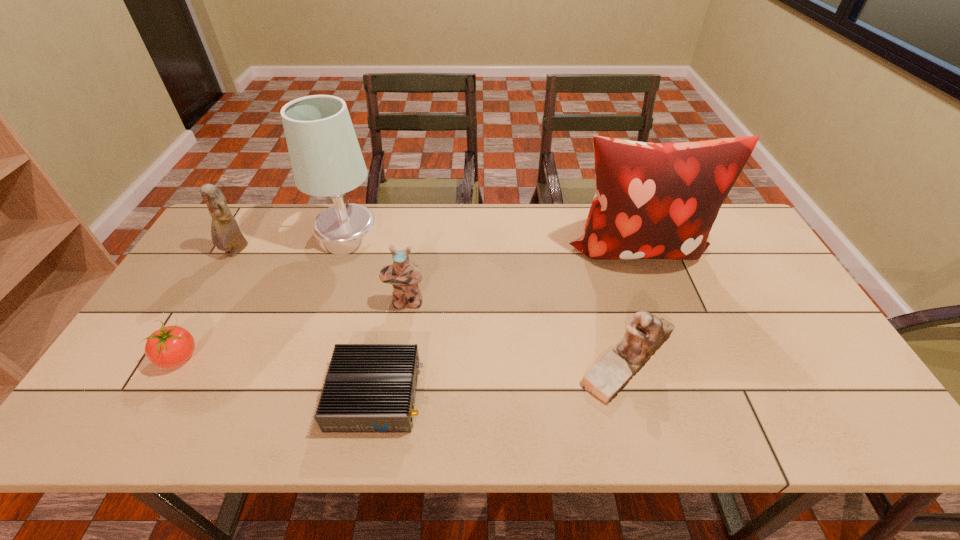
You are a GUI agent. You are given a task and a screenshot of the screen. Output one action in this format:
    pyautogui.click(x=<x>, y=<y>)
    Task: Click on the cushion present at the far edge
    
    Given the screenshot: What is the action you would take?
    pyautogui.click(x=653, y=201)

This screenshot has height=540, width=960. I want to click on figurine that is at the far edge, so click(x=226, y=235).

This screenshot has width=960, height=540. Identify the location of figurine at the near edge. click(645, 333).

Where is `router present at the near edge`? This screenshot has height=540, width=960. router present at the near edge is located at coordinates (369, 388).

Where is `figurine located at the left edge`? This screenshot has width=960, height=540. figurine located at the left edge is located at coordinates 226,235.

Identify the location of tomato that is at the left edge. The height and width of the screenshot is (540, 960). (170, 346).

Image resolution: width=960 pixels, height=540 pixels. Identify the location of object that is at the right edge. coord(653,201).

At what (x,y) coordinates should I click in order to perform the action: click on object that is at the far left corner. Please return your answer as a coordinate pair (x, y). The width and height of the screenshot is (960, 540). Looking at the image, I should click on (226, 235).

You are a GUI agent. You are given a task and a screenshot of the screen. Output one action in this format:
    pyautogui.click(x=<x>, y=<y>)
    Task: Click on the object at the far right corner
    
    Given the screenshot: What is the action you would take?
    [x=653, y=201]

In the image, there is a desktop. Where is `vacant space at the far edge`? vacant space at the far edge is located at coordinates (293, 206).